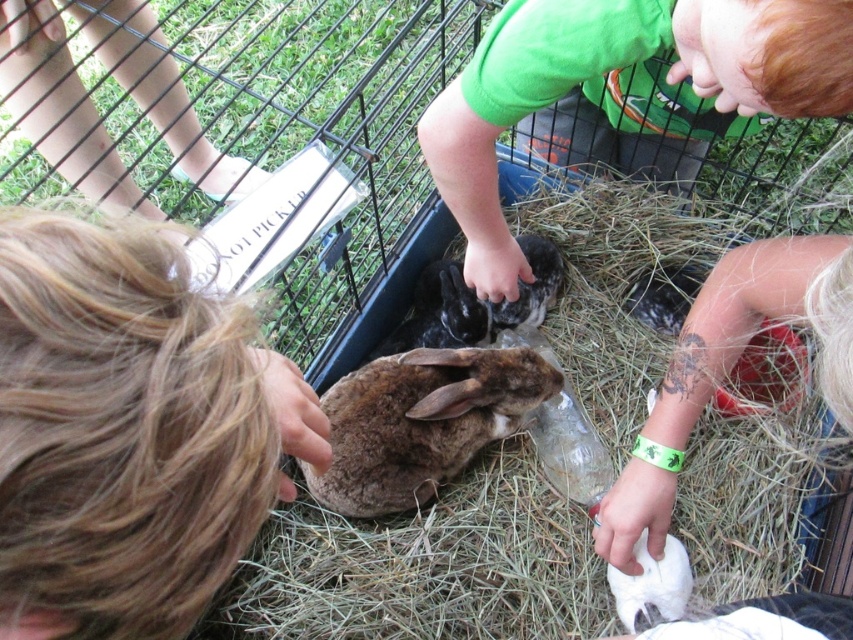
You are a child standing outside the enclosure and want to hand a treat to the white soft fur at lower center. Can you reach it without moving the green cotton shirt at upper center?

The green cotton shirt at upper center is positioned over the white soft fur at lower center, so the white soft fur at lower center is blocked by the green cotton shirt at upper center. Therefore, you cannot reach the white soft fur at lower center without moving the green cotton shirt at upper center.

You are a child trying to place a toy between the brown fuzzy rabbit at center and the white soft fur at lower center. Based on their sizes, which rabbit requires more space to accommodate?

The brown fuzzy rabbit at center requires more space because its width surpasses that of the white soft fur at lower center.

You are standing outside the enclosure and want to place a new toy at the point marked as point (424, 566). What surface will the toy land on?

The point (424, 566) is on brown soft hay at center, so the toy will land on the brown soft hay at center.